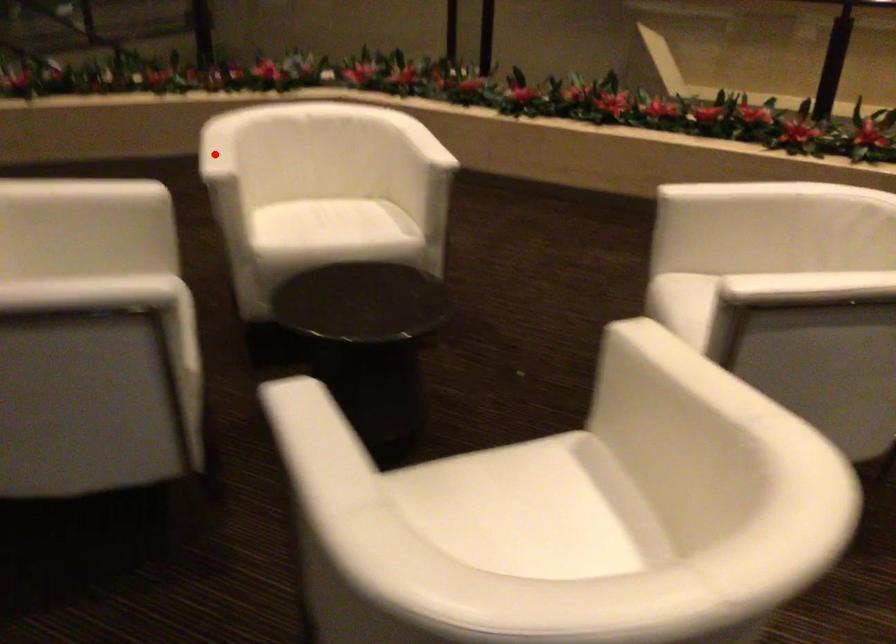
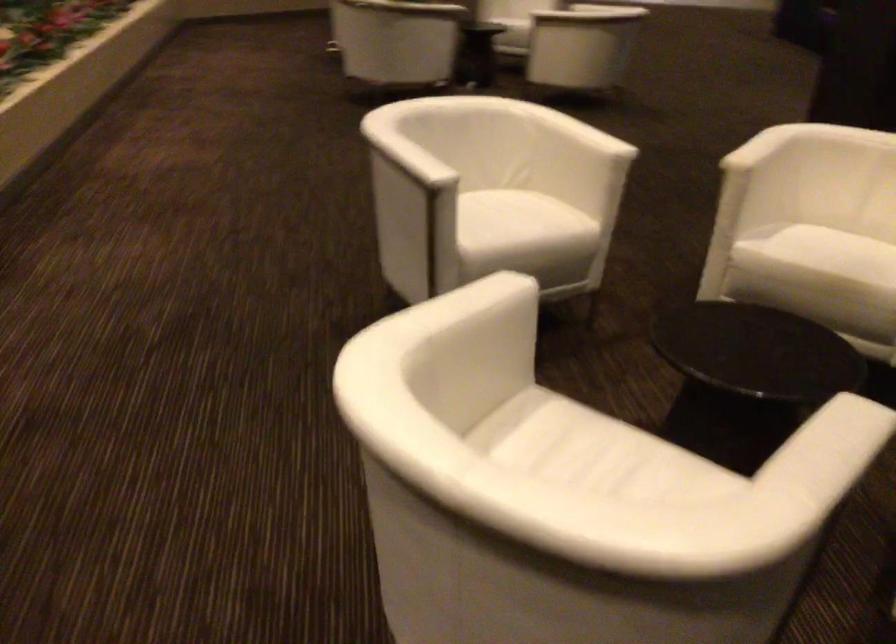
Question: I am providing you with two images of the same scene from different viewpoints. Image1 has a red point marked. In image2, the corresponding 3D location appears at what relative position? Reply with the corresponding letter.

Choices:
 (A) Closer
 (B) Farther

Answer: (A)